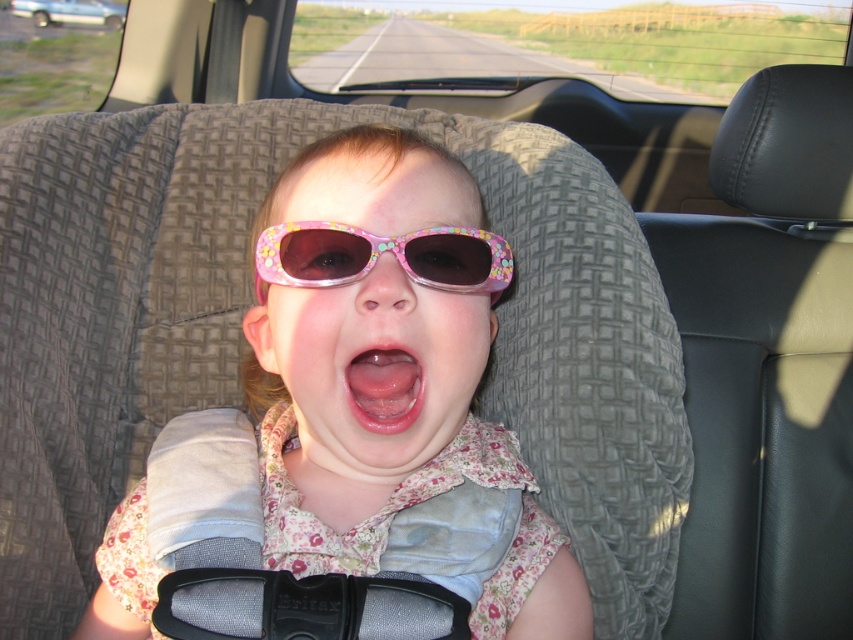
Question: Where is pink floral plastic goggles at center located in relation to metallic silver car at upper left in the image?

Choices:
 (A) below
 (B) above

Answer: (A)

Question: Which of the following is the closest to the observer?

Choices:
 (A) (404, 353)
 (B) (473, 227)

Answer: (A)

Question: Can you confirm if pink floral fabric at center is positioned to the right of metallic silver car at upper left?

Choices:
 (A) no
 (B) yes

Answer: (B)

Question: Which of these objects is positioned closest to the metallic silver car at upper left?

Choices:
 (A) pink floral fabric at center
 (B) pink glossy lips at center
 (C) pink floral plastic goggles at center

Answer: (A)

Question: Which point is closer to the camera?

Choices:
 (A) pink floral plastic goggles at center
 (B) pink glossy lips at center
 (C) metallic silver car at upper left

Answer: (B)

Question: Does pink floral fabric at center appear on the left side of pink floral plastic goggles at center?

Choices:
 (A) yes
 (B) no

Answer: (B)